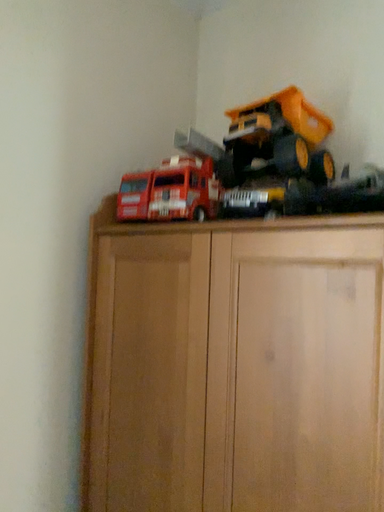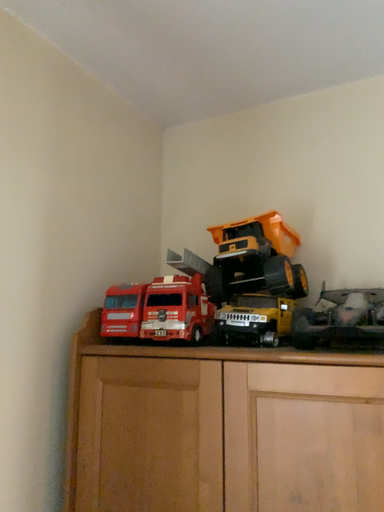
Question: How did the camera likely rotate when shooting the video?

Choices:
 (A) rotated downward
 (B) rotated upward

Answer: (B)